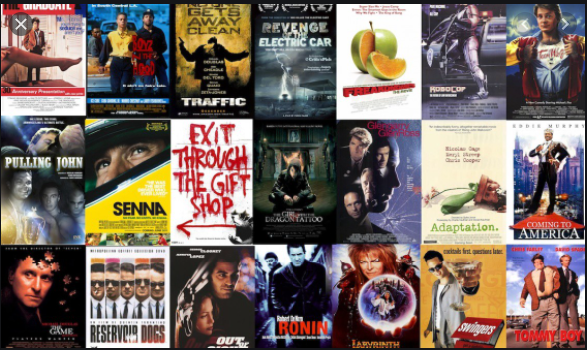
Find the location of `total number of movie posters on the left two rows`. total number of movie posters on the left two rows is located at coordinates click(52, 297), click(124, 291), click(42, 181), click(116, 166), click(46, 67), click(134, 73).